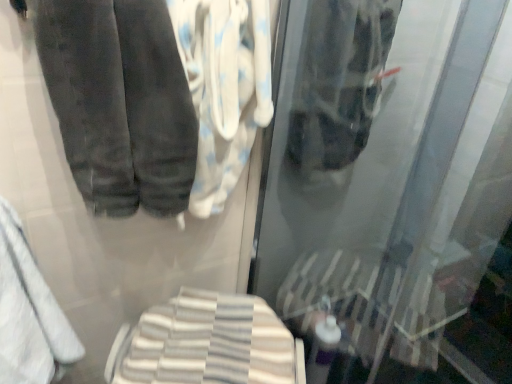
What do you see at coordinates (224, 88) in the screenshot? I see `white cotton towel at center, acting as the first cloth starting from the top` at bounding box center [224, 88].

The image size is (512, 384). Describe the element at coordinates (389, 180) in the screenshot. I see `transparent glass shower door at center` at that location.

At what (x,y) coordinates should I click in order to perform the action: click on white soft towel at lower left. Please return your answer as a coordinate pair (x, y). Looking at the image, I should click on (29, 312).

You are a GUI agent. You are given a task and a screenshot of the screen. Output one action in this format:
    pyautogui.click(x=<x>, y=<y>)
    Task: Click on the white striped towel at lower center, which ranks as the 1th cloth in bottom-to-top order
    The height and width of the screenshot is (384, 512).
    Given the screenshot: What is the action you would take?
    pyautogui.click(x=206, y=343)

Does dark gray velvety trousers at upper left appear on the right side of white striped towel at lower center, which ranks as the 1th cloth in bottom-to-top order?

No, dark gray velvety trousers at upper left is not to the right of white striped towel at lower center, which ranks as the 1th cloth in bottom-to-top order.

Who is more distant, dark gray velvety trousers at upper left or white striped towel at lower center, which ranks as the 1th cloth in bottom-to-top order?

white striped towel at lower center, which ranks as the 1th cloth in bottom-to-top order.

Does dark gray velvety trousers at upper left have a lesser height compared to white striped towel at lower center, which ranks as the 1th cloth in bottom-to-top order?

In fact, dark gray velvety trousers at upper left may be taller than white striped towel at lower center, which ranks as the 1th cloth in bottom-to-top order.

Which is correct: dark gray velvety trousers at upper left is inside white soft towel at lower left, or outside of it?

The correct answer is: outside.

Is point (128, 133) less distant than point (60, 336)?

Yes, point (128, 133) is closer to viewer.

Is dark gray velvety trousers at upper left positioned before white soft towel at lower left?

Yes, dark gray velvety trousers at upper left is closer to the camera.

Is dark gray velvety trousers at upper left far from white soft towel at lower left?

They are positioned close to each other.

Can you confirm if white striped towel at lower center, the 2th cloth from the top, is positioned to the right of dark gray velvety trousers at upper left?

Indeed, white striped towel at lower center, the 2th cloth from the top, is positioned on the right side of dark gray velvety trousers at upper left.

From the picture: From a real-world perspective, which object rests below the other?

white striped towel at lower center, the 2th cloth from the top, is physically lower.

Between white striped towel at lower center, the 2th cloth from the top, and dark gray velvety trousers at upper left, which one is positioned behind?

white striped towel at lower center, the 2th cloth from the top, is behind.

How many degrees apart are the facing directions of white striped towel at lower center, which ranks as the 1th cloth in bottom-to-top order, and dark gray velvety trousers at upper left?

They differ by 36 degrees in their facing directions.

Between transparent glass shower door at center and white cotton towel at center, acting as the first cloth starting from the top, which one appears on the left side from the viewer's perspective?

white cotton towel at center, acting as the first cloth starting from the top, is more to the left.

From the image's perspective, which object appears higher, transparent glass shower door at center or white cotton towel at center, placed as the second cloth when sorted from bottom to top?

white cotton towel at center, placed as the second cloth when sorted from bottom to top, from the image's perspective.

Between transparent glass shower door at center and white cotton towel at center, placed as the second cloth when sorted from bottom to top, which one has larger width?

Wider between the two is white cotton towel at center, placed as the second cloth when sorted from bottom to top.

Considering the positions of objects transparent glass shower door at center and white cotton towel at center, acting as the first cloth starting from the top, in the image provided, who is in front, transparent glass shower door at center or white cotton towel at center, acting as the first cloth starting from the top,?

Positioned in front is transparent glass shower door at center.

Who is bigger, transparent glass shower door at center or white striped towel at lower center, which ranks as the 1th cloth in bottom-to-top order?

transparent glass shower door at center.

Is white striped towel at lower center, the 2th cloth from the top, located within transparent glass shower door at center?

No, white striped towel at lower center, the 2th cloth from the top, is not inside transparent glass shower door at center.

From the image's perspective, is transparent glass shower door at center positioned above or below white striped towel at lower center, the 2th cloth from the top?

transparent glass shower door at center is above white striped towel at lower center, the 2th cloth from the top.

Identify the location of cloth below the transparent glass shower door at center (from the image's perspective). The height and width of the screenshot is (384, 512). (206, 343).

Would you say white striped towel at lower center, the 2th cloth from the top, contains transparent glass shower door at center?

No, transparent glass shower door at center is not a part of white striped towel at lower center, the 2th cloth from the top.

Considering the sizes of white striped towel at lower center, which ranks as the 1th cloth in bottom-to-top order, and transparent glass shower door at center in the image, is white striped towel at lower center, which ranks as the 1th cloth in bottom-to-top order, bigger or smaller than transparent glass shower door at center?

In the image, white striped towel at lower center, which ranks as the 1th cloth in bottom-to-top order, appears to be smaller than transparent glass shower door at center.

Which is closer, [262,337] or [374,0]?

The point [374,0] is closer to the camera.

Is transparent glass shower door at center wider or thinner than dark gray velvety trousers at upper left?

transparent glass shower door at center is thinner than dark gray velvety trousers at upper left.

In the scene shown: Is transparent glass shower door at center aimed at dark gray velvety trousers at upper left?

Yes, transparent glass shower door at center is facing dark gray velvety trousers at upper left.

From the image's perspective, does transparent glass shower door at center appear lower than dark gray velvety trousers at upper left?

Yes, from the image's perspective, transparent glass shower door at center is below dark gray velvety trousers at upper left.

Can you see transparent glass shower door at center touching dark gray velvety trousers at upper left?

transparent glass shower door at center and dark gray velvety trousers at upper left are not in contact.

Locate an element on the screen. trousers in front of the white striped towel at lower center, the 2th cloth from the top is located at coordinates (120, 103).

Find the location of a particular element. This screenshot has height=384, width=512. towel lying on the left of dark gray velvety trousers at upper left is located at coordinates (29, 312).

Looking at the image, which one is located further to white cotton towel at center, acting as the first cloth starting from the top, transparent glass shower door at center or white striped towel at lower center, which ranks as the 1th cloth in bottom-to-top order?

white striped towel at lower center, which ranks as the 1th cloth in bottom-to-top order, is positioned further to the anchor white cotton towel at center, acting as the first cloth starting from the top.

Consider the image. Considering their positions, is dark gray velvety trousers at upper left positioned closer to white soft towel at lower left than white cotton towel at center, acting as the first cloth starting from the top?

Among the two, dark gray velvety trousers at upper left is located nearer to white soft towel at lower left.

Estimate the real-world distances between objects in this image. Which object is closer to white striped towel at lower center, the 2th cloth from the top, transparent glass shower door at center or white soft towel at lower left?

Among the two, white soft towel at lower left is located nearer to white striped towel at lower center, the 2th cloth from the top.

Which object lies further to the anchor point white soft towel at lower left, white striped towel at lower center, which ranks as the 1th cloth in bottom-to-top order, or transparent glass shower door at center?

transparent glass shower door at center.

Considering their positions, is white striped towel at lower center, which ranks as the 1th cloth in bottom-to-top order, positioned closer to dark gray velvety trousers at upper left than transparent glass shower door at center?

white striped towel at lower center, which ranks as the 1th cloth in bottom-to-top order, is closer to dark gray velvety trousers at upper left.

Considering their positions, is white striped towel at lower center, the 2th cloth from the top, positioned closer to transparent glass shower door at center than dark gray velvety trousers at upper left?

The object closer to transparent glass shower door at center is white striped towel at lower center, the 2th cloth from the top.

Which object lies nearer to the anchor point dark gray velvety trousers at upper left, white striped towel at lower center, the 2th cloth from the top, or white cotton towel at center, placed as the second cloth when sorted from bottom to top?

white cotton towel at center, placed as the second cloth when sorted from bottom to top, is closer to dark gray velvety trousers at upper left.

When comparing their distances from white striped towel at lower center, the 2th cloth from the top, does white soft towel at lower left or white cotton towel at center, placed as the second cloth when sorted from bottom to top, seem further?

white cotton towel at center, placed as the second cloth when sorted from bottom to top, is further to white striped towel at lower center, the 2th cloth from the top.

The width and height of the screenshot is (512, 384). In order to click on towel between white cotton towel at center, placed as the second cloth when sorted from bottom to top, and white striped towel at lower center, the 2th cloth from the top, in the vertical direction in this screenshot , I will do `click(29, 312)`.

In order to click on cloth located between transparent glass shower door at center and white striped towel at lower center, the 2th cloth from the top, in the depth direction in this screenshot , I will do `click(224, 88)`.

Locate an element on the screen. This screenshot has width=512, height=384. cloth between dark gray velvety trousers at upper left and white soft towel at lower left in the vertical direction is located at coordinates (224, 88).

You are a GUI agent. You are given a task and a screenshot of the screen. Output one action in this format:
    pyautogui.click(x=<x>, y=<y>)
    Task: Click on the towel that lies between dark gray velvety trousers at upper left and white striped towel at lower center, which ranks as the 1th cloth in bottom-to-top order, from top to bottom
    
    Given the screenshot: What is the action you would take?
    pyautogui.click(x=29, y=312)